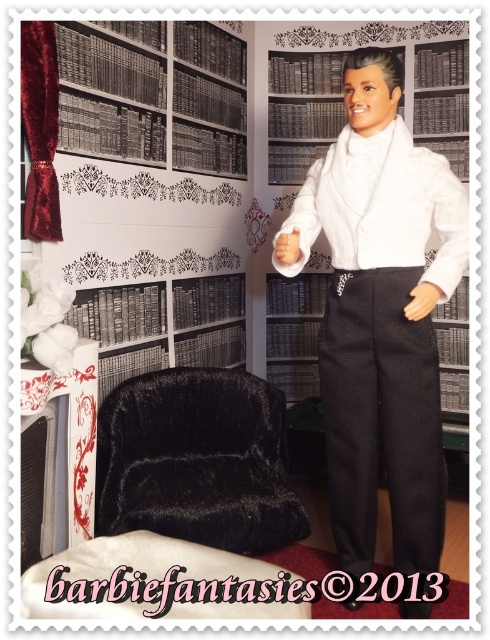
Can you confirm if white satin tuxedo at center is positioned below velvet black armchair at lower left?

No.

Is white satin tuxedo at center shorter than velvet black armchair at lower left?

Incorrect, white satin tuxedo at center's height does not fall short of velvet black armchair at lower left's.

Between point (386, 260) and point (214, 400), which one is positioned behind?

The point (214, 400) is more distant.

The image size is (490, 640). Find the location of `white satin tuxedo at center`. white satin tuxedo at center is located at coordinates [x=381, y=314].